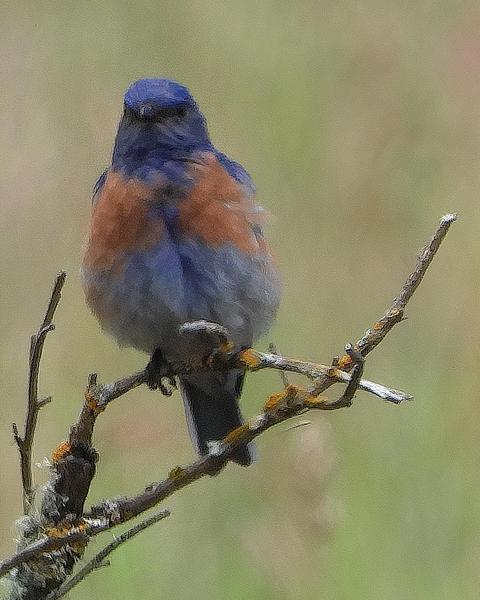
Locate an element on the screen. chest is located at coordinates (173, 247).